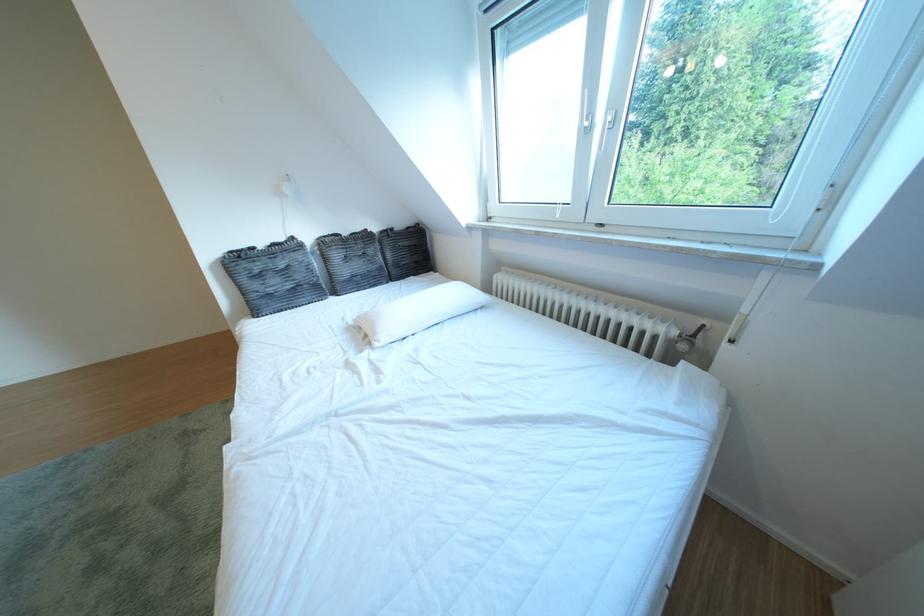
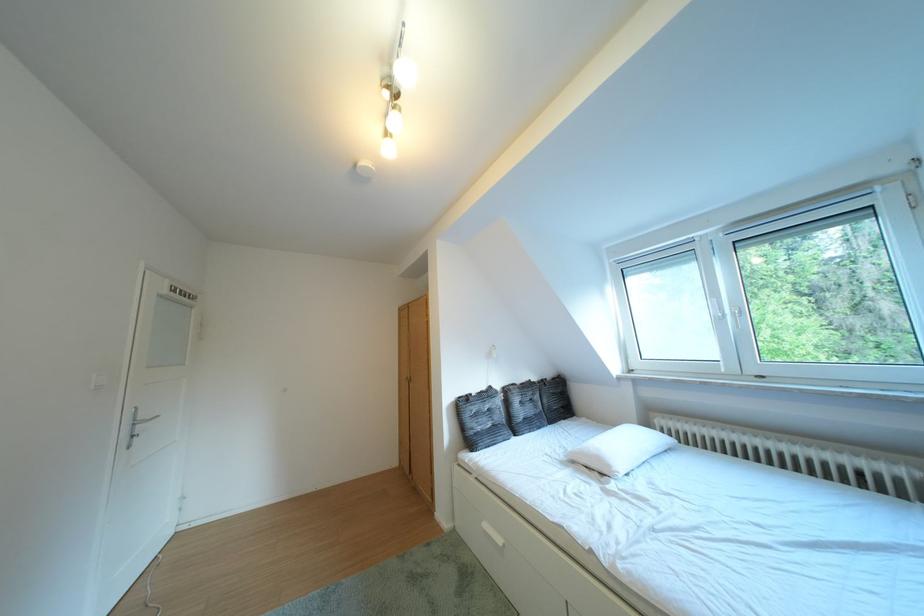
The point at [268,301] is marked in the first image. Where is the corresponding point in the second image?

(484, 438)